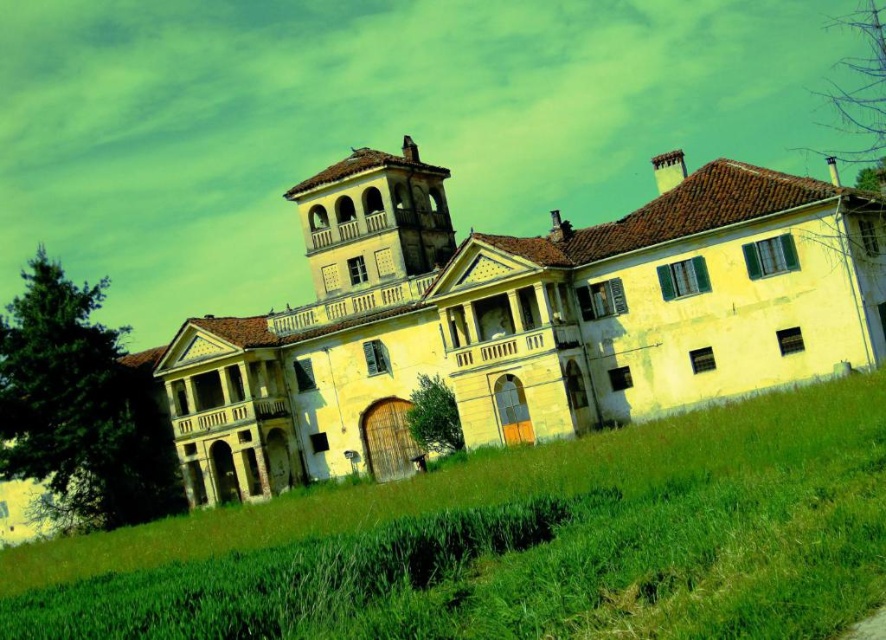
Based on the scene description, where is the yellow matte building at center located in the image?

The yellow matte building at center is located at point (519, 320).

You are standing in a rural area and see the yellow matte building at center and the green grassy field at lower center. Which object is located to the right of the other?

The yellow matte building at center is positioned on the right side of green grassy field at lower center.